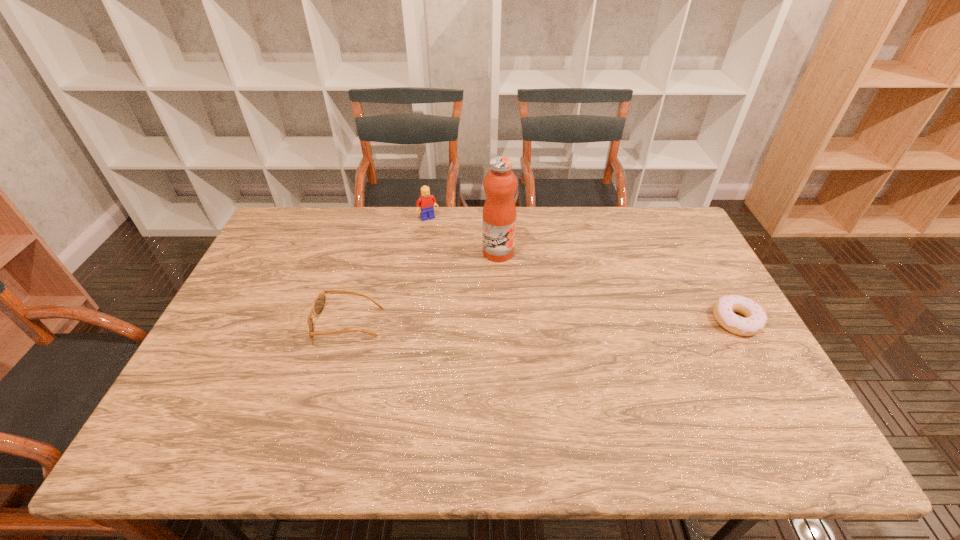
You are a GUI agent. You are given a task and a screenshot of the screen. Output one action in this format:
    pyautogui.click(x=<x>, y=<y>)
    Task: Click on the free spot between the shortest object and the tallest object
    
    Given the screenshot: What is the action you would take?
    pyautogui.click(x=617, y=286)

Locate an element on the screen. free spot between the fruit juice and the third tallest object is located at coordinates (423, 288).

At what (x,y) coordinates should I click in order to perform the action: click on empty space that is in between the fruit juice and the Lego. Please return your answer as a coordinate pair (x, y). This screenshot has width=960, height=540. Looking at the image, I should click on (463, 235).

Image resolution: width=960 pixels, height=540 pixels. Find the location of `unoccupied area between the farthest object and the leftmost object`. unoccupied area between the farthest object and the leftmost object is located at coordinates (388, 271).

Identify the location of free space between the rightmost object and the sunglasses. (542, 322).

Where is `free space between the fruit juice and the third tallest object`? free space between the fruit juice and the third tallest object is located at coordinates (423, 288).

Locate an element on the screen. free space between the doughnut and the sunglasses is located at coordinates (542, 322).

Where is `free space between the third object from right to left and the fruit juice`? The height and width of the screenshot is (540, 960). free space between the third object from right to left and the fruit juice is located at coordinates (463, 235).

The width and height of the screenshot is (960, 540). I want to click on object identified as the second closest to the third nearest object, so (319, 303).

At what (x,y) coordinates should I click in order to perform the action: click on object that is the third nearest to the doughnut. Please return your answer as a coordinate pair (x, y). Looking at the image, I should click on (319, 303).